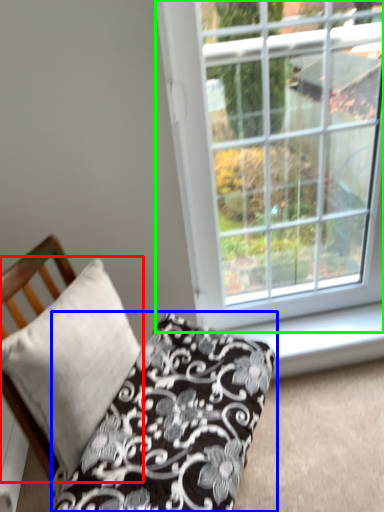
Question: Which object is the closest to the pillow (highlighted by a red box)? Choose among these: pillow (highlighted by a blue box) or window (highlighted by a green box).

Choices:
 (A) pillow
 (B) window

Answer: (A)